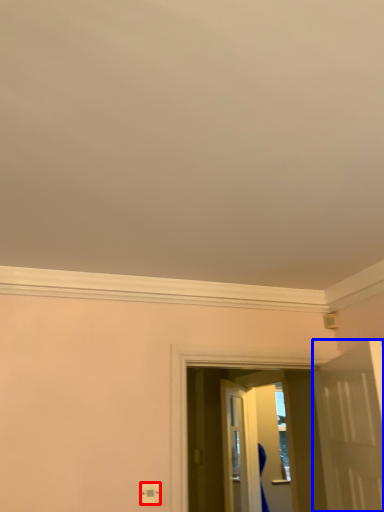
Question: Which object is further to the camera taking this photo, electric outlet (highlighted by a red box) or door (highlighted by a blue box)?

Choices:
 (A) electric outlet
 (B) door

Answer: (A)